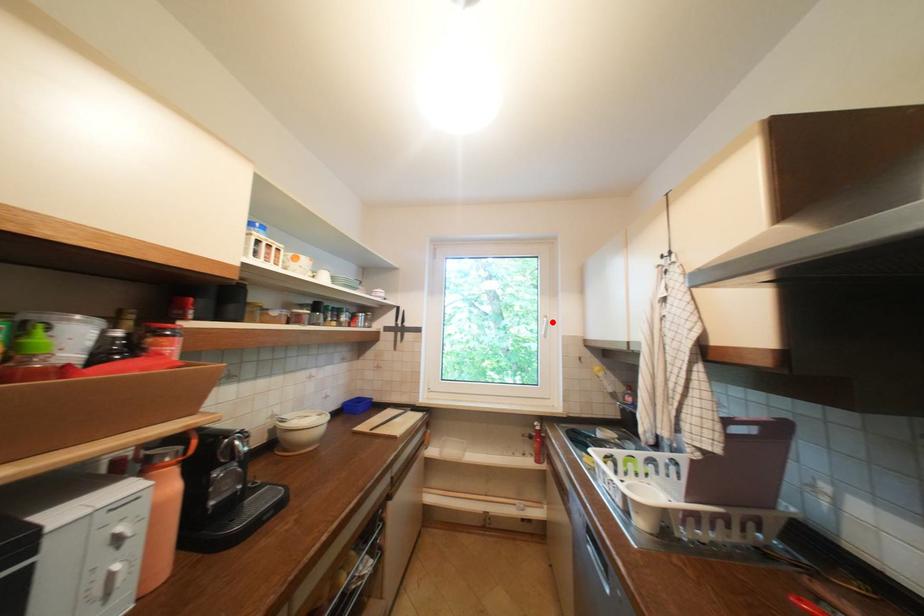
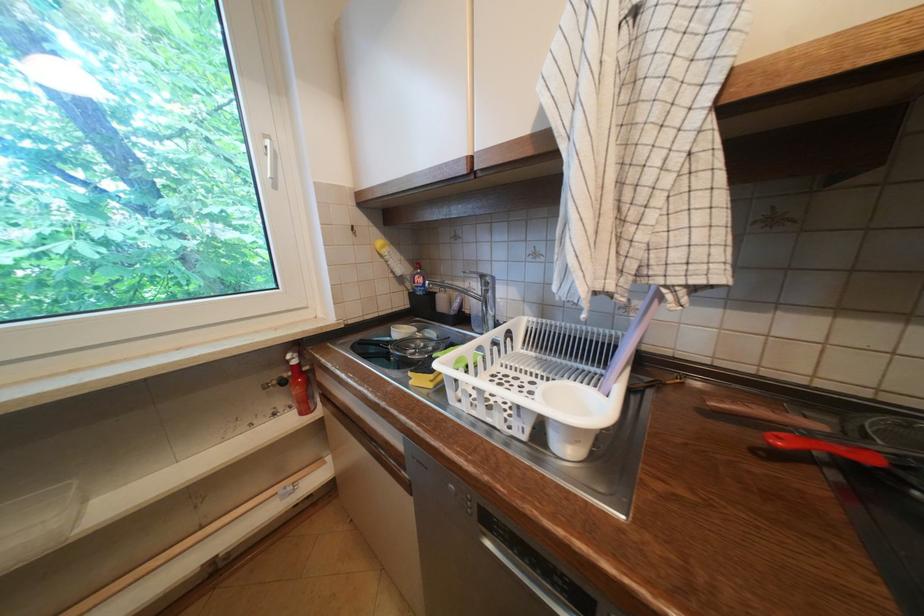
Find the pixel in the second image that matches the highlighted location in the first image.

(274, 148)